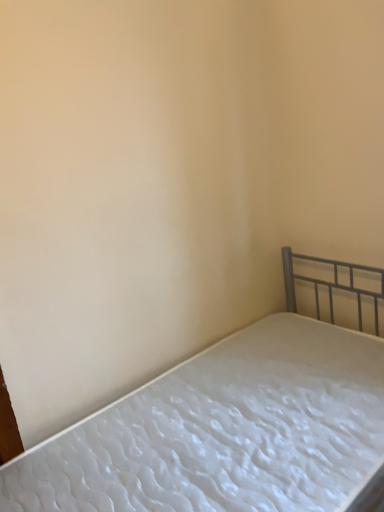
This screenshot has height=512, width=384. What do you see at coordinates (229, 426) in the screenshot? I see `white foam mattress at lower right` at bounding box center [229, 426].

Find the location of `white foam mattress at lower right`. white foam mattress at lower right is located at coordinates (229, 426).

At what (x,y) coordinates should I click in order to perform the action: click on white foam mattress at lower right. Please return your answer as a coordinate pair (x, y). The width and height of the screenshot is (384, 512). Looking at the image, I should click on (229, 426).